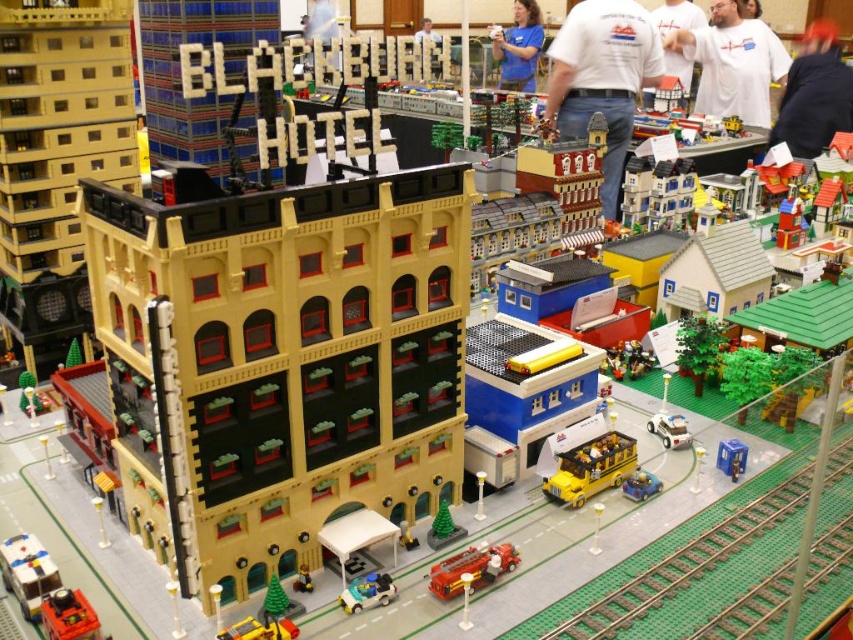
From the picture: Can you confirm if shiny black train at lower left is taller than matte yellow car at center?

Yes.

Is shiny black train at lower left shorter than matte yellow car at center?

No.

Does point (62, 588) come farther from viewer compared to point (653, 474)?

That is False.

Where is `shiny black train at lower left`? The image size is (853, 640). shiny black train at lower left is located at coordinates (68, 616).

Is point (637, 474) farther from viewer compared to point (434, 32)?

No.

Between point (646, 476) and point (427, 36), which one is positioned in front?

Point (427, 36) is more forward.

Identify the location of matte yellow car at center. (640, 484).

Locate an element on the screen. The height and width of the screenshot is (640, 853). matte yellow car at center is located at coordinates (640, 484).

Can you confirm if blue shirt at upper center is positioned to the left of shiny black train at lower left?

In fact, blue shirt at upper center is to the right of shiny black train at lower left.

Does point (527, 88) come closer to viewer compared to point (59, 628)?

No, (527, 88) is further to viewer.

At what (x,y) coordinates should I click in order to perform the action: click on blue shirt at upper center. Please return your answer as a coordinate pair (x, y). The width and height of the screenshot is (853, 640). Looking at the image, I should click on (519, 48).